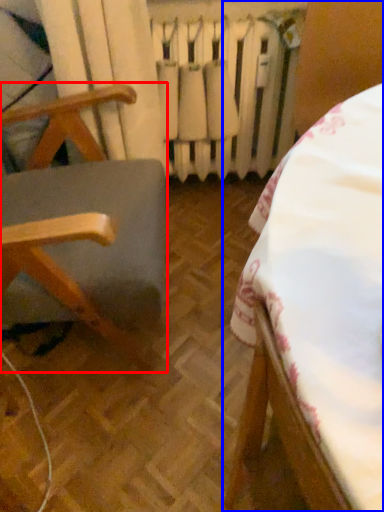
Question: Which of the following is the closest to the observer, furniture (highlighted by a red box) or furniture (highlighted by a blue box)?

Choices:
 (A) furniture
 (B) furniture

Answer: (B)